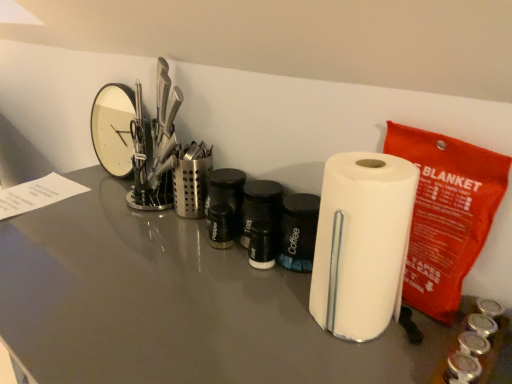
Question: From the image's perspective, is satin silver utensil holder at center, which ranks as the 1th stationery in back-to-front order, positioned above or below white matte paper towel at center?

Choices:
 (A) below
 (B) above

Answer: (B)

Question: From a real-world perspective, is satin silver utensil holder at center, which ranks as the 1th stationery in back-to-front order, physically located above or below white matte paper towel at center?

Choices:
 (A) above
 (B) below

Answer: (B)

Question: Which object is the farthest from the white matte paper towel at center?

Choices:
 (A) satin silver utensil holder at center, which is the second stationery in right-to-left order
 (B) white paper towel at right, the 2th stationery when ordered from back to front
 (C) white glossy paper towel holder at center

Answer: (A)

Question: Which object is the farthest from the white matte paper towel at center?

Choices:
 (A) white glossy paper towel holder at center
 (B) white paper towel at right, arranged as the first stationery when viewed from the right
 (C) satin silver utensil holder at center, which is counted as the second stationery, starting from the front

Answer: (C)